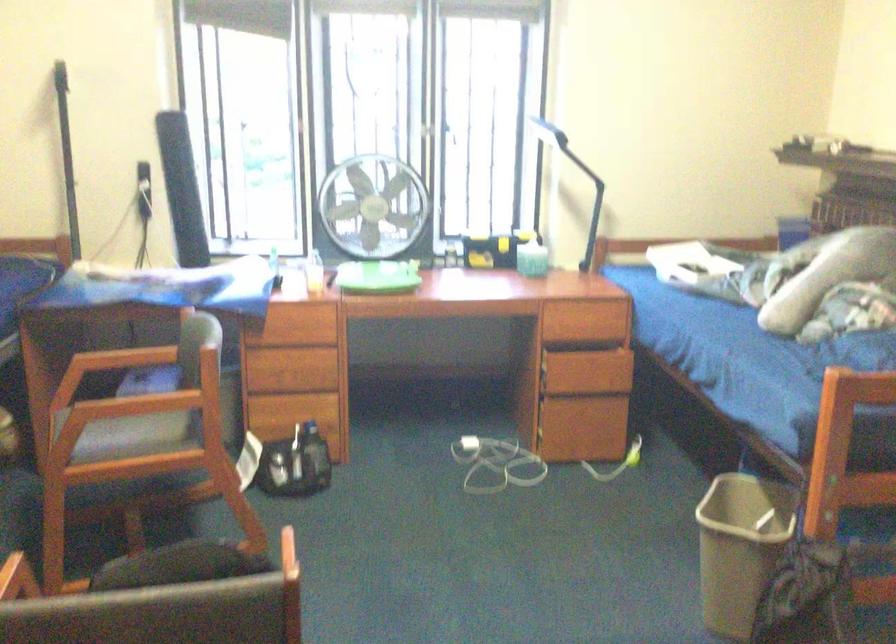
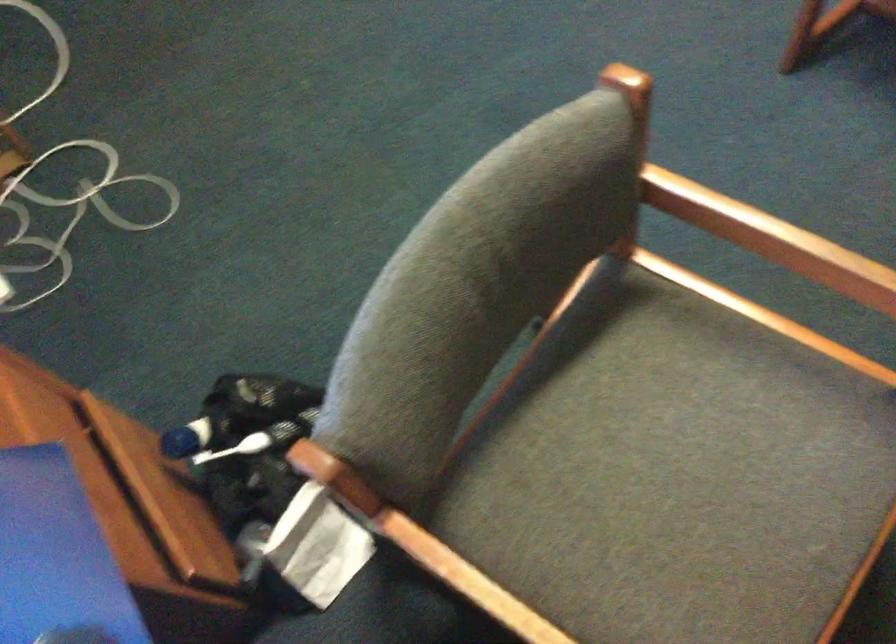
The point at (151, 433) is marked in the first image. Where is the corresponding point in the second image?

(643, 444)